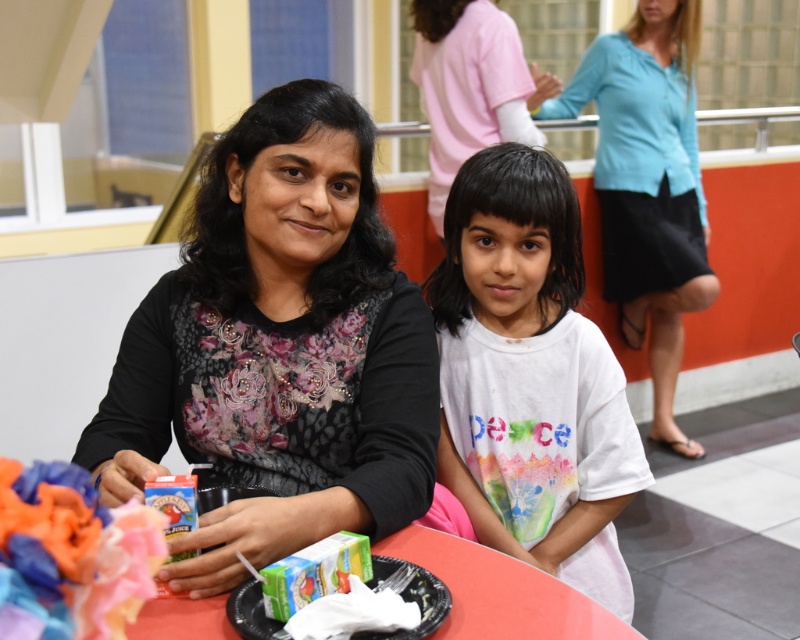
Question: Does white cotton shirt at center have a larger size compared to green cardboard juice box at lower center?

Choices:
 (A) yes
 (B) no

Answer: (A)

Question: Which point is closer to the camera?

Choices:
 (A) (576, 108)
 (B) (290, 428)
 (C) (106, 586)

Answer: (C)

Question: Is black floral dress at center bigger than green cardboard juice box at lower center?

Choices:
 (A) no
 (B) yes

Answer: (B)

Question: Can you confirm if white cotton shirt at center is positioned to the right of blue fabric skirt at upper right?

Choices:
 (A) no
 (B) yes

Answer: (A)

Question: Among these points, which one is nearest to the camera?

Choices:
 (A) (62, 620)
 (B) (498, 188)
 (C) (424, 428)
 (D) (421, 634)

Answer: (A)

Question: Among these points, which one is nearest to the camera?

Choices:
 (A) (672, 307)
 (B) (532, 474)

Answer: (B)